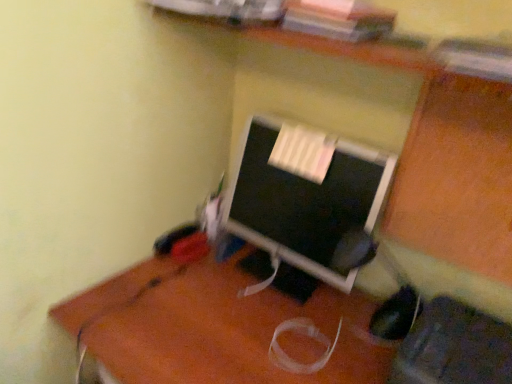
You are a GUI agent. You are given a task and a screenshot of the screen. Output one action in this format:
    pyautogui.click(x=<x>, y=<y>)
    Task: Click on the empty space that is ontop of brown wooden desk at center (from a real-world perspective)
    The image size is (512, 384).
    Given the screenshot: What is the action you would take?
    pyautogui.click(x=242, y=311)